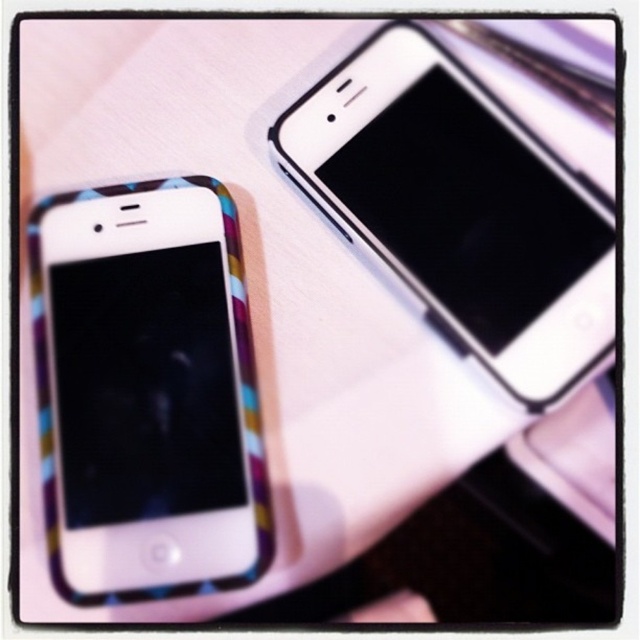
You want to place both the matte plastic phone at left and the white glossy smartphone at upper right into a phone case that requires the phone to be wider than 12 centimeters. Based on the scene, which phone might not fit into the case?

The matte plastic phone at left has a width less than the white glossy smartphone at upper right, so the matte plastic phone at left might not fit into the case since it is narrower than the required 12 centimeters.

You are organizing a display for a tech store and need to arrange the matte plastic phone at left and the white glossy smartphone at upper right on a shelf. Given their sizes, which phone should you place first to maximize shelf space efficiency?

The matte plastic phone at left occupies less space than the white glossy smartphone at upper right, so you should place the white glossy smartphone at upper right first to utilize the shelf space more efficiently.